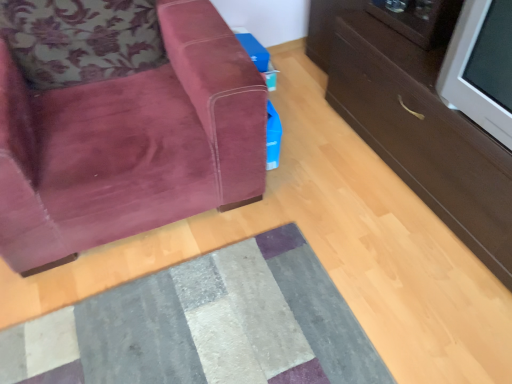
Locate an element on the screen. The height and width of the screenshot is (384, 512). unoccupied region to the right of velvet maroon armchair at left is located at coordinates (337, 216).